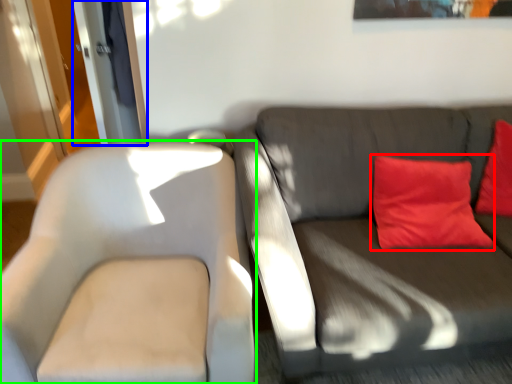
Question: Which object is positioned farthest from pillow (highlighted by a red box)? Select from glass door (highlighted by a blue box) and chair (highlighted by a green box).

Choices:
 (A) glass door
 (B) chair

Answer: (A)